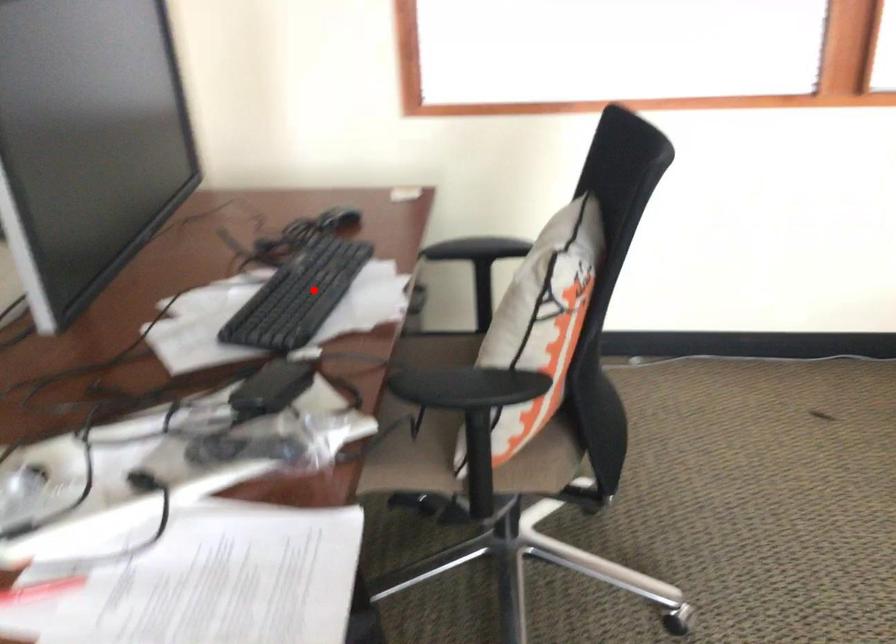
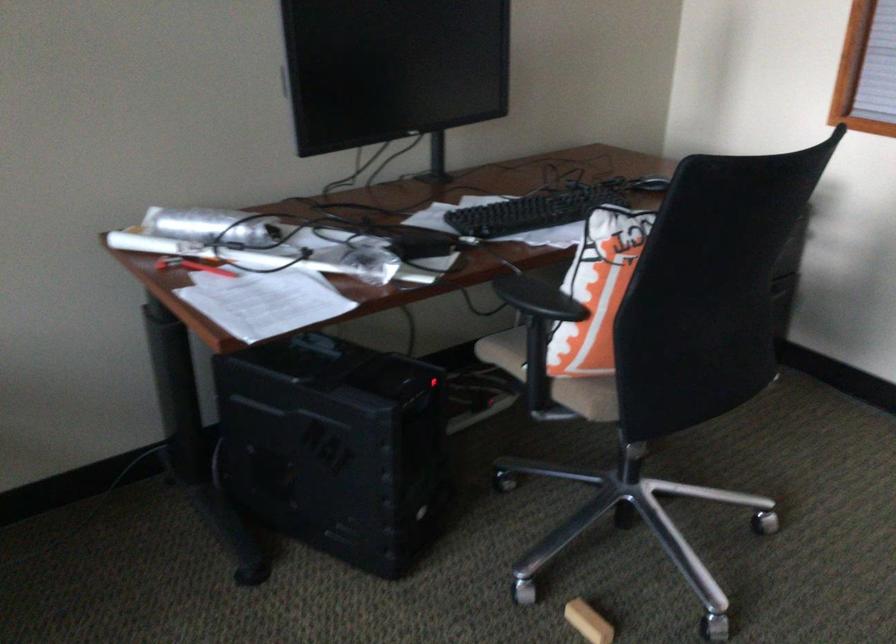
Question: I am providing you with two images of the same scene from different viewpoints. A red point is shown in image1. For the corresponding object point in image2, is it positioned nearer or farther from the camera?

Choices:
 (A) Nearer
 (B) Farther

Answer: (B)